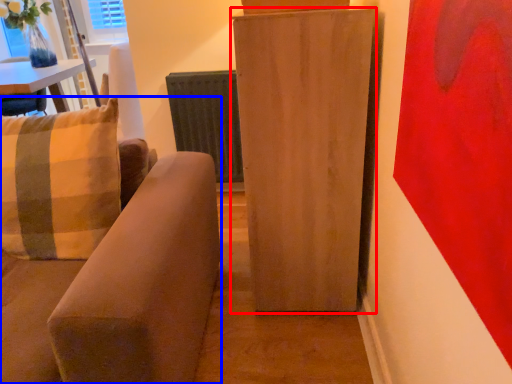
Question: Which object is further to the camera taking this photo, furniture (highlighted by a red box) or studio couch (highlighted by a blue box)?

Choices:
 (A) furniture
 (B) studio couch

Answer: (A)